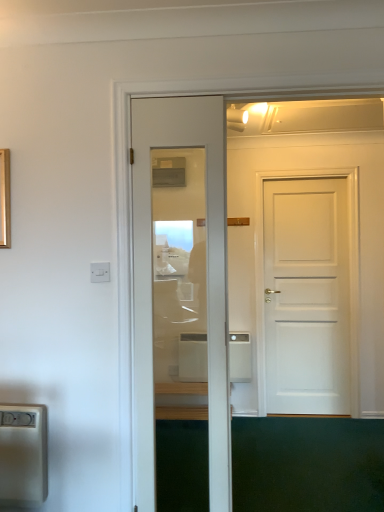
Where is `white plastic electric outlet at left`? The height and width of the screenshot is (512, 384). white plastic electric outlet at left is located at coordinates (100, 272).

This screenshot has height=512, width=384. Describe the element at coordinates (100, 272) in the screenshot. I see `white plastic electric outlet at left` at that location.

What is the approximate height of white plastic electric outlet at left?

It is 3.38 inches.

Identify the location of white plastic electric outlet at left. (100, 272).